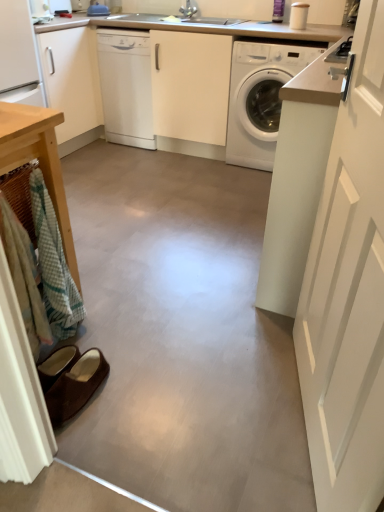
Question: Considering the positions of white glossy counter top at upper center and smooth concrete floor at center in the image, is white glossy counter top at upper center wider or thinner than smooth concrete floor at center?

Choices:
 (A) thin
 (B) wide

Answer: (A)

Question: Considering the positions of white glossy counter top at upper center and smooth concrete floor at center in the image, is white glossy counter top at upper center taller or shorter than smooth concrete floor at center?

Choices:
 (A) tall
 (B) short

Answer: (A)

Question: Which is farther from the smooth concrete floor at center?

Choices:
 (A) wooden table at left
 (B) brown suede slippers at lower left
 (C) white matte door at right
 (D) white glossy counter top at upper center
 (E) white glossy washing machine at center

Answer: (D)

Question: Which of these objects is positioned farthest from the white glossy counter top at upper center?

Choices:
 (A) wooden table at left
 (B) smooth concrete floor at center
 (C) white matte door at right
 (D) white glossy washing machine at center
 (E) white glossy dishwasher at center

Answer: (C)